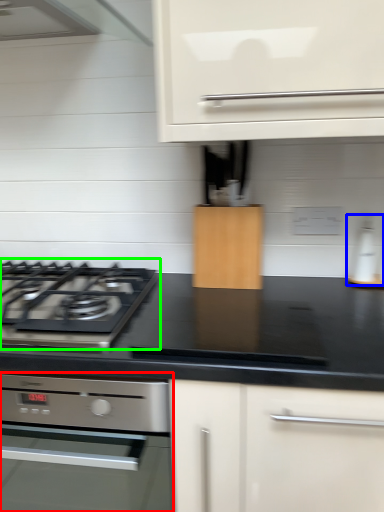
Question: Which object is positioned closest to home appliance (highlighted by a red box)? Select from kitchen appliance (highlighted by a blue box) and gas stove (highlighted by a green box).

Choices:
 (A) kitchen appliance
 (B) gas stove

Answer: (B)